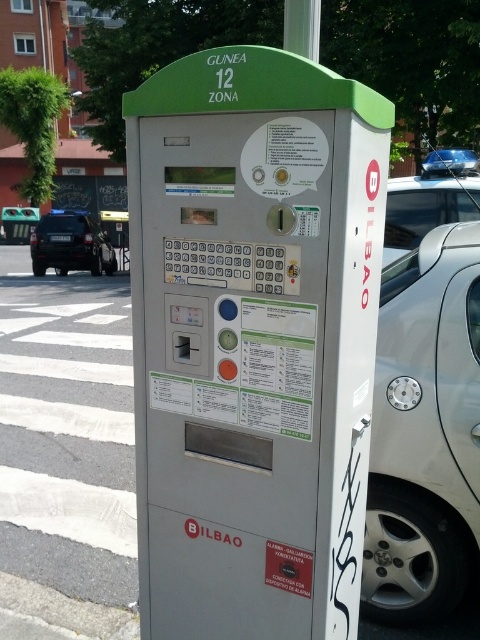
Question: Which object appears closest to the camera in this image?

Choices:
 (A) white plastic pole at upper center
 (B) dark gray metallic suv at left
 (C) metallic silver car at right
 (D) white glossy car at right

Answer: (A)

Question: Which point is farther to the camera?

Choices:
 (A) white glossy car at right
 (B) white plastic pole at upper center

Answer: (A)

Question: Among these points, which one is farthest from the camera?

Choices:
 (A) (108, 259)
 (B) (319, 35)

Answer: (A)

Question: Is dark gray metallic suv at left to the right of metallic silver car at right from the viewer's perspective?

Choices:
 (A) yes
 (B) no

Answer: (B)

Question: Is white glossy car at right to the right of white plastic pole at upper center from the viewer's perspective?

Choices:
 (A) yes
 (B) no

Answer: (A)

Question: Considering the relative positions of silver metallic car at right and dark gray metallic suv at left in the image provided, where is silver metallic car at right located with respect to dark gray metallic suv at left?

Choices:
 (A) below
 (B) above

Answer: (A)